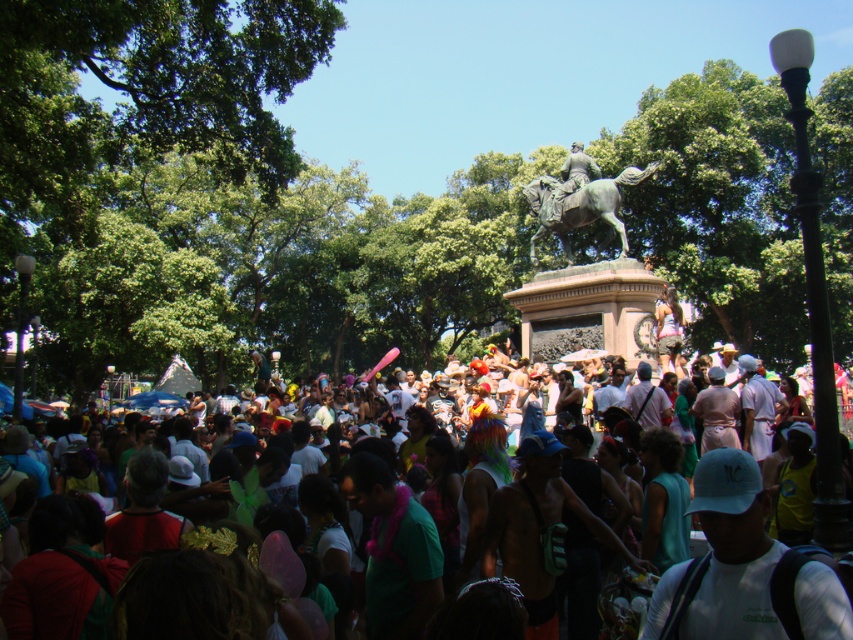
You are a photographer trying to capture a clear shot of the bronze polished horse at center and the bronze statue at upper center. Based on their sizes, which one do you think might block the view of the other when positioned between them?

The bronze polished horse at center might be wider than bronze statue at upper center, so it could potentially block the view of the bronze statue at upper center if placed between them.

You are a photographer standing in the crowd and want to take a photo of both the bronze polished horse at center and the bronze statue at upper center. Which object should you focus on first to ensure it appears larger in your photo?

You should focus on the bronze polished horse at center first because it has a larger size compared to the bronze statue at upper center, so it will naturally appear bigger in the photo.

You are standing at the point labeled as point (798,588) in the image and want to take a photo of the camera located somewhere in the scene. Considering the distance between them, do you think you can capture the camera in your photo without moving from your current position?

The distance between point (798,588) and the camera is 39.13 meters. Since the camera is quite far away, it might be difficult to capture a clear or recognizable image of it from that distance without moving. However, if the camera is within the field of view and the zoom capabilities of your camera allow it, it might be possible. But based solely on the distance provided, it could be challenging.